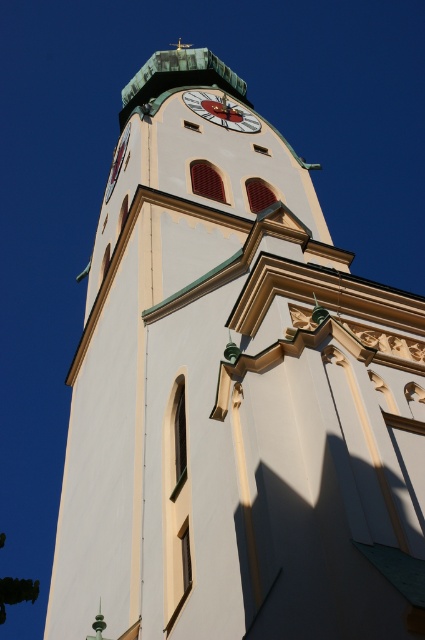
Which of these two, white glossy clock at upper center or white painted clock at upper center, stands shorter?

Standing shorter between the two is white glossy clock at upper center.

Can you confirm if white glossy clock at upper center is smaller than white painted clock at upper center?

Yes.

Which is in front, point (223, 102) or point (110, 189)?

Point (110, 189)

Locate an element on the screen. white glossy clock at upper center is located at coordinates (221, 109).